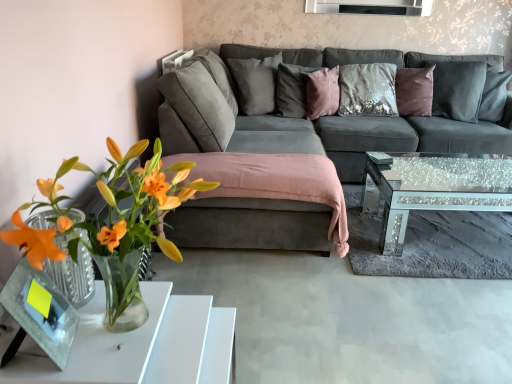
Measure the distance between point (x=229, y=59) and camera.

The distance of point (x=229, y=59) from camera is 3.41 meters.

Identify the location of sparkly glass coffee table at center. click(436, 187).

In order to face suede gray couch at center, should I rotate leftwards or rightwards?

Turn right approximately 15.222 degrees to face it.

At what (x,y) coordinates should I click in order to perform the action: click on pink velvet pillow at center, which is the third pillow in right-to-left order. Please return your answer as a coordinate pair (x, y). Looking at the image, I should click on (292, 89).

Which of these two, satin gray pillow at upper center, which is the 1th pillow from left to right, or translucent glass vase at lower left, stands taller?

Standing taller between the two is translucent glass vase at lower left.

The width and height of the screenshot is (512, 384). Find the location of `houseplant on the left side of satin gray pillow at upper center, which is the 1th pillow from left to right`. houseplant on the left side of satin gray pillow at upper center, which is the 1th pillow from left to right is located at coordinates (112, 225).

How many degrees apart are the facing directions of satin gray pillow at upper center, acting as the 4th pillow starting from the right, and translucent glass vase at lower left?

The facing directions of satin gray pillow at upper center, acting as the 4th pillow starting from the right, and translucent glass vase at lower left are 57.1 degrees apart.

From the image's perspective, relative to translucent glass vase at lower left, is satin gray pillow at upper center, acting as the 4th pillow starting from the right, above or below?

From the image's perspective, satin gray pillow at upper center, acting as the 4th pillow starting from the right, appears above translucent glass vase at lower left.

How much distance is there between satin gray pillow at upper center, which is the 1th pillow from left to right, and sparkly glass coffee table at center?

4.01 feet.

Between satin gray pillow at upper center, acting as the 4th pillow starting from the right, and sparkly glass coffee table at center, which one appears on the right side from the viewer's perspective?

Positioned to the right is sparkly glass coffee table at center.

Which object is further away from the camera, satin gray pillow at upper center, which is the 1th pillow from left to right, or sparkly glass coffee table at center?

satin gray pillow at upper center, which is the 1th pillow from left to right, is further away from the camera.

Does satin gray pillow at upper center, which is the 1th pillow from left to right, have a smaller size compared to sparkly glass coffee table at center?

Yes, satin gray pillow at upper center, which is the 1th pillow from left to right, is smaller than sparkly glass coffee table at center.

Considering the positions of points (466, 209) and (240, 73), is point (466, 209) farther from camera compared to point (240, 73)?

No.

Is sparkly glass coffee table at center oriented towards satin gray pillow at upper center, acting as the 4th pillow starting from the right?

No.

Where is `coffee table on the right of satin gray pillow at upper center, acting as the 4th pillow starting from the right`? This screenshot has height=384, width=512. coffee table on the right of satin gray pillow at upper center, acting as the 4th pillow starting from the right is located at coordinates (436, 187).

Does point (455, 88) appear closer or farther from the camera than point (295, 107)?

Point (455, 88) appears to be closer to the viewer than point (295, 107).

Is velvet purple pillow at upper right, which is the 4th pillow in left-to-right order, positioned far away from pink velvet pillow at center, marked as the 2th pillow in a left-to-right arrangement?

Indeed, velvet purple pillow at upper right, which is the 4th pillow in left-to-right order, is not near pink velvet pillow at center, marked as the 2th pillow in a left-to-right arrangement.

From the image's perspective, is velvet purple pillow at upper right, acting as the 1th pillow starting from the right, located above or below pink velvet pillow at center, which is the third pillow in right-to-left order?

Based on their image positions, velvet purple pillow at upper right, acting as the 1th pillow starting from the right, is located beneath pink velvet pillow at center, which is the third pillow in right-to-left order.

Can you tell me how much velvet purple pillow at upper right, acting as the 1th pillow starting from the right, and pink velvet pillow at center, marked as the 2th pillow in a left-to-right arrangement, differ in facing direction?

The angle between the facing direction of velvet purple pillow at upper right, acting as the 1th pillow starting from the right, and the facing direction of pink velvet pillow at center, marked as the 2th pillow in a left-to-right arrangement, is 52.8 degrees.

Which of these two, satin purple pillow at center, acting as the second pillow starting from the right, or suede gray couch at center, is bigger?

suede gray couch at center is bigger.

Between satin purple pillow at center, arranged as the third pillow when viewed from the left, and suede gray couch at center, which one has larger width?

With larger width is suede gray couch at center.

From the image's perspective, which one is positioned lower, satin purple pillow at center, arranged as the third pillow when viewed from the left, or suede gray couch at center?

suede gray couch at center appears lower in the image.

Could you tell me if sparkly glass coffee table at center is turned towards pink velvet pillow at center, marked as the 2th pillow in a left-to-right arrangement?

No, sparkly glass coffee table at center is not aimed at pink velvet pillow at center, marked as the 2th pillow in a left-to-right arrangement.

Would you say sparkly glass coffee table at center contains pink velvet pillow at center, marked as the 2th pillow in a left-to-right arrangement?

No, sparkly glass coffee table at center does not contain pink velvet pillow at center, marked as the 2th pillow in a left-to-right arrangement.

Is sparkly glass coffee table at center not close to pink velvet pillow at center, marked as the 2th pillow in a left-to-right arrangement?

Absolutely, sparkly glass coffee table at center is distant from pink velvet pillow at center, marked as the 2th pillow in a left-to-right arrangement.

Would you say sparkly glass coffee table at center is to the left or to the right of pink velvet pillow at center, which is the third pillow in right-to-left order, in the picture?

In the image, sparkly glass coffee table at center appears on the right side of pink velvet pillow at center, which is the third pillow in right-to-left order.

Is the position of velvet purple pillow at upper right, which is the 4th pillow in left-to-right order, less distant than that of translucent glass vase at lower left?

No, velvet purple pillow at upper right, which is the 4th pillow in left-to-right order, is further to the viewer.

Is velvet purple pillow at upper right, acting as the 1th pillow starting from the right, facing away from translucent glass vase at lower left?

No, velvet purple pillow at upper right, acting as the 1th pillow starting from the right,'s orientation is not away from translucent glass vase at lower left.

Is velvet purple pillow at upper right, which is the 4th pillow in left-to-right order, located outside translucent glass vase at lower left?

Indeed, velvet purple pillow at upper right, which is the 4th pillow in left-to-right order, is completely outside translucent glass vase at lower left.

Can you confirm if velvet purple pillow at upper right, acting as the 1th pillow starting from the right, is wider than translucent glass vase at lower left?

No, velvet purple pillow at upper right, acting as the 1th pillow starting from the right, is not wider than translucent glass vase at lower left.

This screenshot has height=384, width=512. I want to click on houseplant above the satin gray pillow at upper center, acting as the 4th pillow starting from the right (from a real-world perspective), so click(x=112, y=225).

Image resolution: width=512 pixels, height=384 pixels. Identify the location of the 2nd pillow behind the sparkly glass coffee table at center, counting from the anchor's position. (255, 83).

Considering their positions, is velvet purple pillow at upper right, which is the 4th pillow in left-to-right order, positioned further to pink velvet pillow at center, marked as the 2th pillow in a left-to-right arrangement, than suede gray couch at center?

velvet purple pillow at upper right, which is the 4th pillow in left-to-right order, is further to pink velvet pillow at center, marked as the 2th pillow in a left-to-right arrangement.

Estimate the real-world distances between objects in this image. Which object is closer to satin purple pillow at center, acting as the second pillow starting from the right, satin gray pillow at upper center, which is the 1th pillow from left to right, or pink velvet pillow at center, which is the third pillow in right-to-left order?

pink velvet pillow at center, which is the third pillow in right-to-left order, lies closer to satin purple pillow at center, acting as the second pillow starting from the right, than the other object.

Which object lies nearer to the anchor point velvet purple pillow at upper right, acting as the 1th pillow starting from the right, sparkly glass coffee table at center or satin purple pillow at center, acting as the second pillow starting from the right?

satin purple pillow at center, acting as the second pillow starting from the right, is closer to velvet purple pillow at upper right, acting as the 1th pillow starting from the right.

Looking at the image, which one is located closer to suede gray couch at center, translucent glass vase at lower left or sparkly glass coffee table at center?

Among the two, sparkly glass coffee table at center is located nearer to suede gray couch at center.

When comparing their distances from pink velvet pillow at center, which is the third pillow in right-to-left order, does suede gray couch at center or velvet purple pillow at upper right, acting as the 1th pillow starting from the right, seem closer?

suede gray couch at center is positioned closer to the anchor pink velvet pillow at center, which is the third pillow in right-to-left order.

Looking at the image, which one is located closer to satin purple pillow at center, arranged as the third pillow when viewed from the left, suede gray couch at center or velvet purple pillow at upper right, acting as the 1th pillow starting from the right?

suede gray couch at center lies closer to satin purple pillow at center, arranged as the third pillow when viewed from the left, than the other object.

Based on their spatial positions, is satin gray pillow at upper center, which is the 1th pillow from left to right, or suede gray couch at center further from sparkly glass coffee table at center?

Based on the image, satin gray pillow at upper center, which is the 1th pillow from left to right, appears to be further to sparkly glass coffee table at center.

From the image, which object appears to be nearer to translucent glass vase at lower left, velvet purple pillow at upper right, acting as the 1th pillow starting from the right, or suede gray couch at center?

suede gray couch at center.

At what (x,y) coordinates should I click in order to perform the action: click on studio couch located between translucent glass vase at lower left and satin purple pillow at center, acting as the second pillow starting from the right, in the depth direction. Please return your answer as a coordinate pair (x, y). Looking at the image, I should click on (337, 111).

Locate an element on the screen. The width and height of the screenshot is (512, 384). coffee table between white glossy table at lower left and velvet purple pillow at upper right, acting as the 1th pillow starting from the right, in the horizontal direction is located at coordinates (436, 187).

The height and width of the screenshot is (384, 512). Find the location of `coffee table between white glossy table at lower left and satin gray pillow at upper center, acting as the 4th pillow starting from the right, in the front-back direction`. coffee table between white glossy table at lower left and satin gray pillow at upper center, acting as the 4th pillow starting from the right, in the front-back direction is located at coordinates (436, 187).

In order to click on studio couch between translucent glass vase at lower left and satin gray pillow at upper center, acting as the 4th pillow starting from the right, from front to back in this screenshot , I will do `click(337, 111)`.